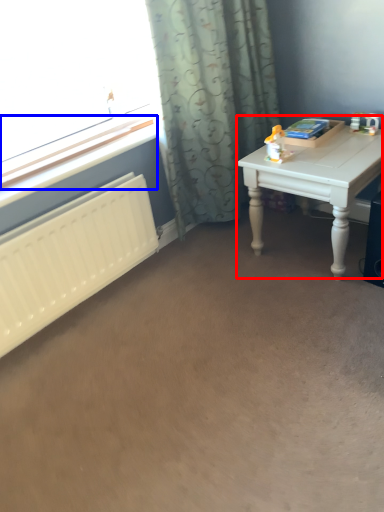
Question: Which point is further to the camera, table (highlighted by a red box) or window sill (highlighted by a blue box)?

Choices:
 (A) table
 (B) window sill

Answer: (A)